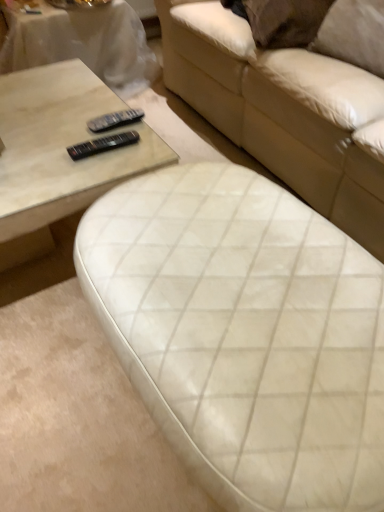
The height and width of the screenshot is (512, 384). I want to click on vacant space to the left of black plastic remote at center, the second remote positioned from the top, so click(x=49, y=147).